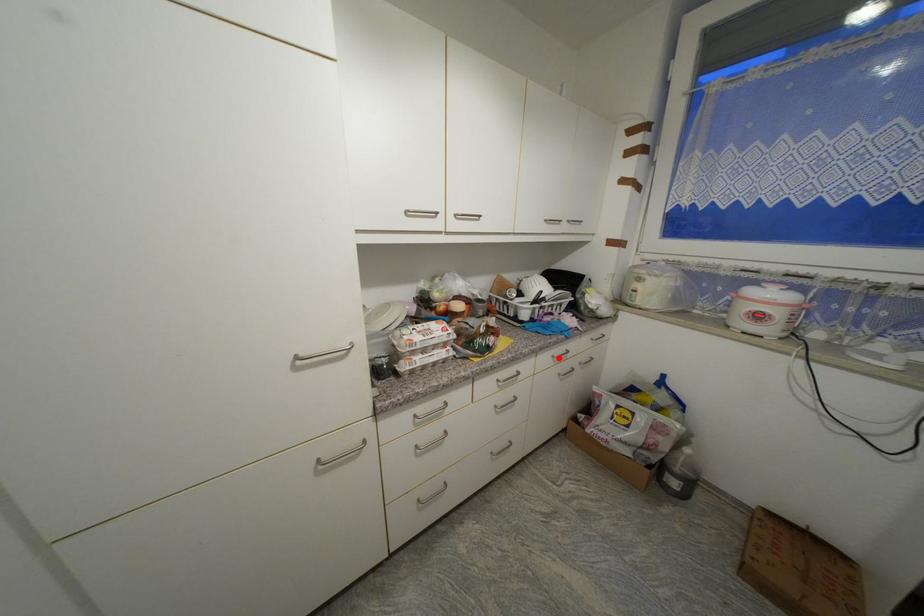
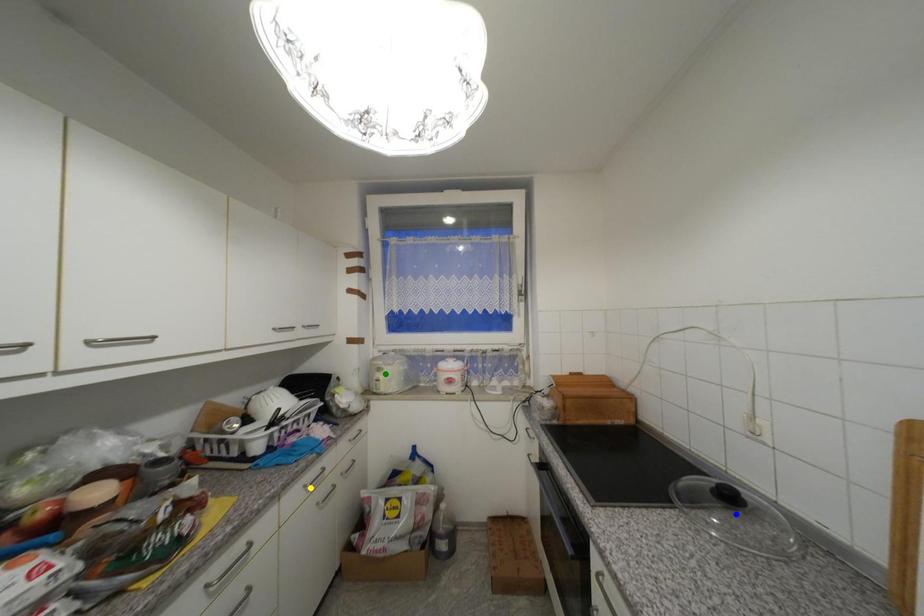
Question: I am providing you with two images of the same scene from different viewpoints. A red point is marked on the first image. You are given multiple points on the second image. Which mark in image 2 goes with the point in image 1?

Choices:
 (A) yellow point
 (B) green point
 (C) blue point

Answer: (A)